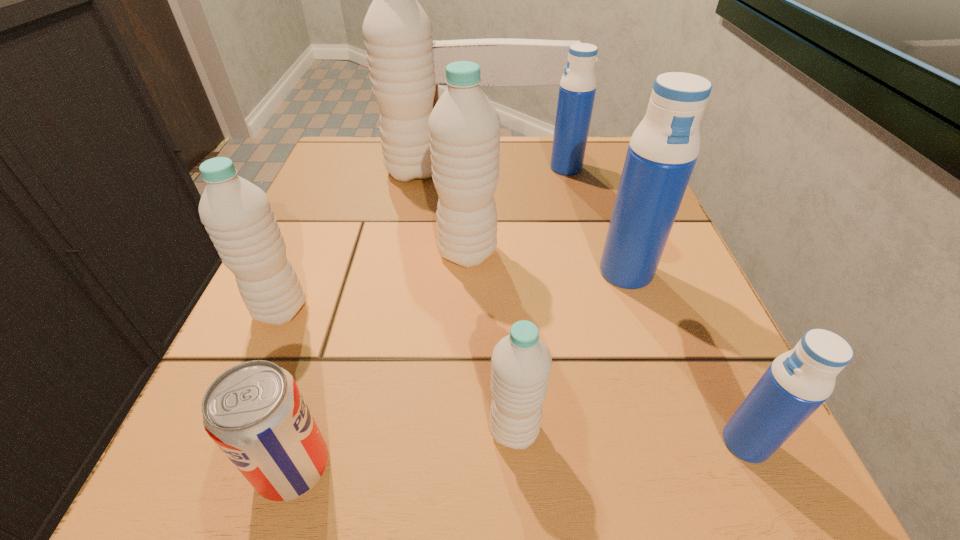
I want to click on soda, so click(255, 413).

Find the location of a particular element. The image size is (960, 540). vacant region located 0.070m on the back of the biggest white water bottle is located at coordinates (420, 143).

Locate an element on the screen. vacant space located on the back of the third nearest white water bottle is located at coordinates (470, 156).

You are a GUI agent. You are given a task and a screenshot of the screen. Output one action in this format:
    pyautogui.click(x=<x>, y=<y>)
    Task: Click on the free space located on the back of the second nearest blue water bottle
    This screenshot has width=960, height=540.
    Given the screenshot: What is the action you would take?
    pyautogui.click(x=603, y=206)

This screenshot has height=540, width=960. Identify the location of free region located on the front of the second smallest blue water bottle. (577, 207).

The height and width of the screenshot is (540, 960). Find the location of `free location located 0.270m on the back of the leftmost water bottle`. free location located 0.270m on the back of the leftmost water bottle is located at coordinates (332, 193).

Identify the location of vacant space located 0.190m on the back of the smallest white water bottle. The width and height of the screenshot is (960, 540). (506, 294).

You are a GUI agent. You are given a task and a screenshot of the screen. Output one action in this format:
    pyautogui.click(x=<x>, y=<y>)
    Task: Click on the vacant area situated on the back of the rightmost blue water bottle
    
    Given the screenshot: What is the action you would take?
    pyautogui.click(x=700, y=341)

Image resolution: width=960 pixels, height=540 pixels. Find the location of `free space located on the right of the soda`. free space located on the right of the soda is located at coordinates (567, 467).

Identify the location of soda that is at the near edge. Image resolution: width=960 pixels, height=540 pixels. (255, 413).